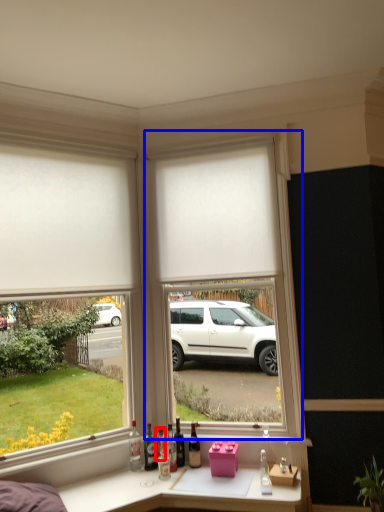
Question: Which object is further to the camera taking this photo, bottle (highlighted by a red box) or window frame (highlighted by a blue box)?

Choices:
 (A) bottle
 (B) window frame

Answer: (A)